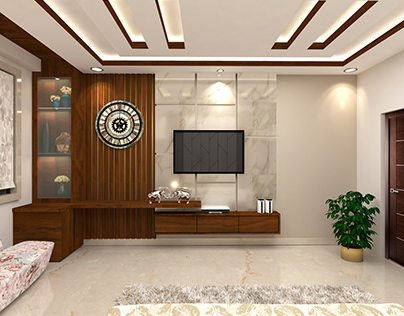
Where is `vertical plank`? The width and height of the screenshot is (404, 316). vertical plank is located at coordinates (133, 171).